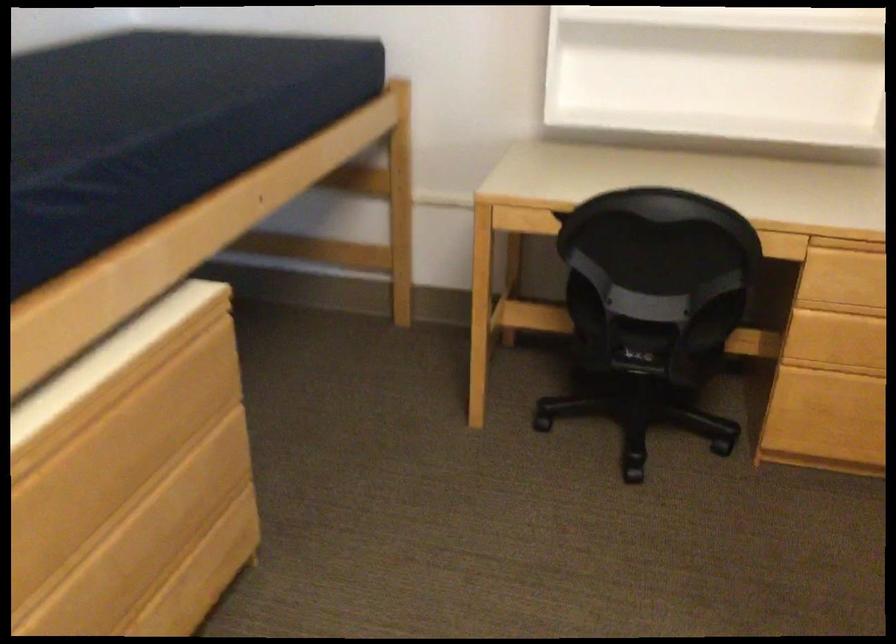
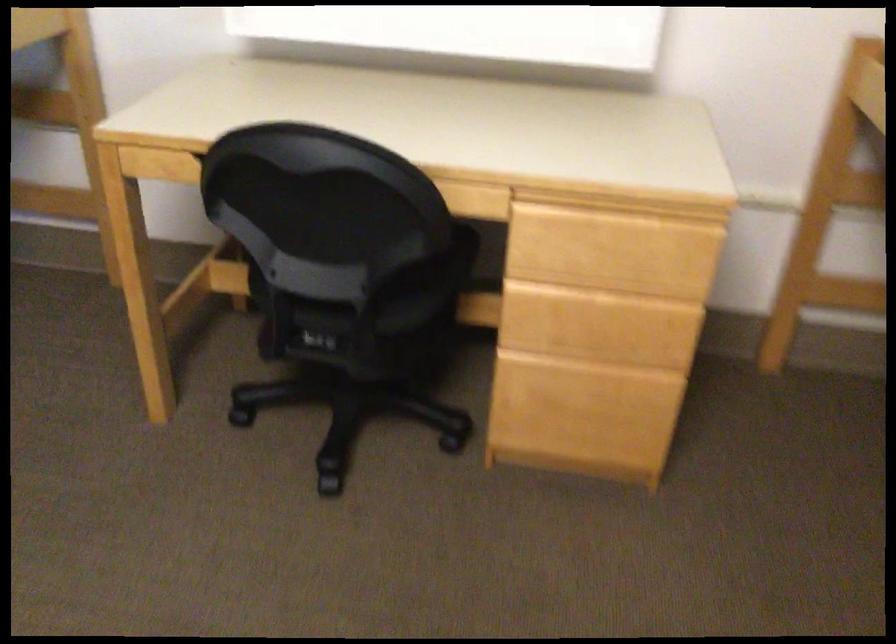
Question: How did the camera likely rotate?

Choices:
 (A) Left
 (B) Right
 (C) Up
 (D) Down

Answer: (D)